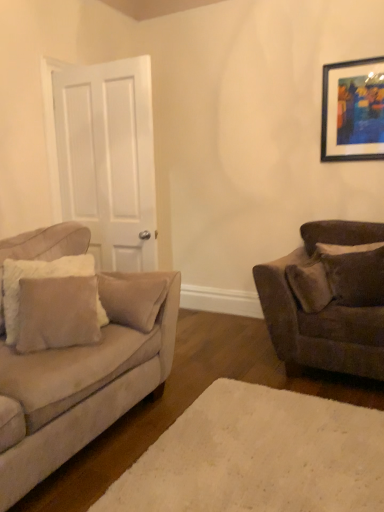
Identify the location of suede-like brown pillow at right, acting as the 1th pillow starting from the back. (356, 276).

Locate an element on the screen. This screenshot has width=384, height=512. wooden-framed artwork at upper right is located at coordinates (351, 111).

Locate an element on the screen. This screenshot has width=384, height=512. suede beige couch at left, which is the first studio couch in left-to-right order is located at coordinates (80, 367).

The height and width of the screenshot is (512, 384). What are the coordinates of `suede-like brown pillow at right, the second pillow positioned from the front` in the screenshot? It's located at (356, 276).

From a real-world perspective, is suede-like brown pillow at right, the 2th pillow when ordered from left to right, positioned above or below wooden-framed artwork at upper right?

Clearly, from a real-world perspective, suede-like brown pillow at right, the 2th pillow when ordered from left to right, is below wooden-framed artwork at upper right.

Does suede-like brown pillow at right, which is counted as the 1th pillow, starting from the right, appear on the left side of wooden-framed artwork at upper right?

Indeed, suede-like brown pillow at right, which is counted as the 1th pillow, starting from the right, is positioned on the left side of wooden-framed artwork at upper right.

Which object is further away from the camera taking this photo, suede-like brown pillow at right, the 2th pillow when ordered from left to right, or wooden-framed artwork at upper right?

wooden-framed artwork at upper right is more distant.

Identify the location of picture frame on the right of velvet brown couch at right, the 2th studio couch from the left. (351, 111).

Consider the image. Is wooden-framed artwork at upper right aimed at velvet brown couch at right, the 2th studio couch from the left?

No, wooden-framed artwork at upper right is not facing towards velvet brown couch at right, the 2th studio couch from the left.

Does point (336, 125) lie behind point (272, 332)?

Yes, point (336, 125) is behind point (272, 332).

From a real-world perspective, is wooden-framed artwork at upper right positioned under velvet brown couch at right, the 2th studio couch from the left, based on gravity?

Incorrect, from a real-world perspective, wooden-framed artwork at upper right is higher than velvet brown couch at right, the 2th studio couch from the left.

Would you say suede beige couch at left, which is the first studio couch in left-to-right order, is inside or outside wooden-framed artwork at upper right?

suede beige couch at left, which is the first studio couch in left-to-right order, is spatially situated outside wooden-framed artwork at upper right.

Is suede beige couch at left, which is the first studio couch in left-to-right order, facing towards wooden-framed artwork at upper right?

No, suede beige couch at left, which is the first studio couch in left-to-right order, is not facing towards wooden-framed artwork at upper right.

From a real-world perspective, count 1st studio couchs downward from the wooden-framed artwork at upper right and point to it. Please provide its 2D coordinates.

[(80, 367)]

Looking at the image, does white plush rug at lower center seem bigger or smaller compared to beige fabric pillow at left, positioned as the second pillow in back-to-front order?

Considering their sizes, white plush rug at lower center takes up less space than beige fabric pillow at left, positioned as the second pillow in back-to-front order.

From a real-world perspective, is white plush rug at lower center over beige fabric pillow at left, positioned as the second pillow in back-to-front order?

Actually, white plush rug at lower center is physically below beige fabric pillow at left, positioned as the second pillow in back-to-front order, in the real world.

Is point (288, 460) closer or farther from the camera than point (101, 308)?

Point (288, 460) appears to be closer to the viewer than point (101, 308).

Is white plush rug at lower center not near beige fabric pillow at left, the 2th pillow positioned from the right?

That's right, there is a large distance between white plush rug at lower center and beige fabric pillow at left, the 2th pillow positioned from the right.

Is suede beige couch at left, which is the first studio couch in left-to-right order, surrounding velvet brown couch at right, marked as the 1th studio couch in a right-to-left arrangement?

No, velvet brown couch at right, marked as the 1th studio couch in a right-to-left arrangement, is not a part of suede beige couch at left, which is the first studio couch in left-to-right order.

Considering the relative positions of suede beige couch at left, which is the first studio couch in left-to-right order, and velvet brown couch at right, the 2th studio couch from the left, in the image provided, is suede beige couch at left, which is the first studio couch in left-to-right order, behind velvet brown couch at right, the 2th studio couch from the left,?

No, the depth of suede beige couch at left, which is the first studio couch in left-to-right order, is less than that of velvet brown couch at right, the 2th studio couch from the left.

Is suede beige couch at left, which is the first studio couch in left-to-right order, facing towards velvet brown couch at right, marked as the 1th studio couch in a right-to-left arrangement?

No, suede beige couch at left, which is the first studio couch in left-to-right order, does not turn towards velvet brown couch at right, marked as the 1th studio couch in a right-to-left arrangement.

Is beige fabric pillow at left, positioned as the 1th pillow in front-to-back order, with white plush rug at lower center?

No, beige fabric pillow at left, positioned as the 1th pillow in front-to-back order, is not with white plush rug at lower center.

From a real-world perspective, which is physically above, beige fabric pillow at left, the 2th pillow positioned from the right, or white plush rug at lower center?

beige fabric pillow at left, the 2th pillow positioned from the right.

Does beige fabric pillow at left, the 2th pillow positioned from the right, have a greater width compared to white plush rug at lower center?

No, beige fabric pillow at left, the 2th pillow positioned from the right, is not wider than white plush rug at lower center.

Does white plush rug at lower center lie in front of suede beige couch at left, which is the first studio couch in left-to-right order?

That is True.

Which of these two, white plush rug at lower center or suede beige couch at left, which is the first studio couch in left-to-right order, is smaller?

Smaller between the two is white plush rug at lower center.

Considering the sizes of white plush rug at lower center and suede beige couch at left, positioned as the 2th studio couch in right-to-left order, in the image, is white plush rug at lower center taller or shorter than suede beige couch at left, positioned as the 2th studio couch in right-to-left order,?

Considering their sizes, white plush rug at lower center has less height than suede beige couch at left, positioned as the 2th studio couch in right-to-left order.

Is white plush rug at lower center beside suede beige couch at left, which is the first studio couch in left-to-right order?

white plush rug at lower center is not next to suede beige couch at left, which is the first studio couch in left-to-right order, and they're not touching.

The width and height of the screenshot is (384, 512). What are the coordinates of `the 1st pillow to the left when counting from the wooden-framed artwork at upper right` in the screenshot? It's located at coord(356,276).

Locate an element on the screen. This screenshot has width=384, height=512. picture frame above the velvet brown couch at right, the 2th studio couch from the left (from the image's perspective) is located at coordinates (351, 111).

When comparing their distances from suede beige couch at left, which is the first studio couch in left-to-right order, does velvet brown couch at right, marked as the 1th studio couch in a right-to-left arrangement, or wooden-framed artwork at upper right seem closer?

Based on the image, velvet brown couch at right, marked as the 1th studio couch in a right-to-left arrangement, appears to be nearer to suede beige couch at left, which is the first studio couch in left-to-right order.

Consider the image. Which object lies further to the anchor point suede-like brown pillow at right, the second pillow positioned from the front, white plush rug at lower center or beige fabric pillow at left, the 1th pillow in the left-to-right sequence?

beige fabric pillow at left, the 1th pillow in the left-to-right sequence, lies further to suede-like brown pillow at right, the second pillow positioned from the front, than the other object.

From the image, which object appears to be farther from wooden-framed artwork at upper right, suede-like brown pillow at right, the 2th pillow when ordered from left to right, or velvet brown couch at right, marked as the 1th studio couch in a right-to-left arrangement?

velvet brown couch at right, marked as the 1th studio couch in a right-to-left arrangement, is further to wooden-framed artwork at upper right.

Considering their positions, is beige fabric pillow at left, positioned as the second pillow in back-to-front order, positioned closer to suede-like brown pillow at right, which is counted as the 1th pillow, starting from the right, than suede beige couch at left, which is the first studio couch in left-to-right order?

suede beige couch at left, which is the first studio couch in left-to-right order, lies closer to suede-like brown pillow at right, which is counted as the 1th pillow, starting from the right, than the other object.

Looking at the image, which one is located further to white plush rug at lower center, suede beige couch at left, positioned as the 2th studio couch in right-to-left order, or beige fabric pillow at left, the 2th pillow positioned from the right?

beige fabric pillow at left, the 2th pillow positioned from the right, lies further to white plush rug at lower center than the other object.

From the image, which object appears to be farther from suede beige couch at left, which is the first studio couch in left-to-right order, wooden-framed artwork at upper right or white matte door at left?

Based on the image, wooden-framed artwork at upper right appears to be further to suede beige couch at left, which is the first studio couch in left-to-right order.

Which object lies further to the anchor point white matte door at left, beige fabric pillow at left, the 1th pillow in the left-to-right sequence, or suede beige couch at left, positioned as the 2th studio couch in right-to-left order?

beige fabric pillow at left, the 1th pillow in the left-to-right sequence, lies further to white matte door at left than the other object.

Looking at the image, which one is located closer to suede beige couch at left, positioned as the 2th studio couch in right-to-left order, velvet brown couch at right, marked as the 1th studio couch in a right-to-left arrangement, or white plush rug at lower center?

white plush rug at lower center is positioned closer to the anchor suede beige couch at left, positioned as the 2th studio couch in right-to-left order.

Locate an element on the screen. The height and width of the screenshot is (512, 384). studio couch between beige fabric pillow at left, positioned as the 1th pillow in front-to-back order, and suede-like brown pillow at right, the second pillow positioned from the front, from left to right is located at coordinates (307, 327).

Where is `pillow situated between suede beige couch at left, positioned as the 2th studio couch in right-to-left order, and suede-like brown pillow at right, the 2th pillow when ordered from left to right, from left to right`? Image resolution: width=384 pixels, height=512 pixels. pillow situated between suede beige couch at left, positioned as the 2th studio couch in right-to-left order, and suede-like brown pillow at right, the 2th pillow when ordered from left to right, from left to right is located at coordinates (37, 277).

In order to click on door situated between beige fabric pillow at left, the 1th pillow in the left-to-right sequence, and wooden-framed artwork at upper right from left to right in this screenshot , I will do `click(105, 158)`.

At what (x,y) coordinates should I click in order to perform the action: click on door between suede beige couch at left, which is the first studio couch in left-to-right order, and velvet brown couch at right, marked as the 1th studio couch in a right-to-left arrangement. Please return your answer as a coordinate pair (x, y). Image resolution: width=384 pixels, height=512 pixels. Looking at the image, I should click on (105, 158).